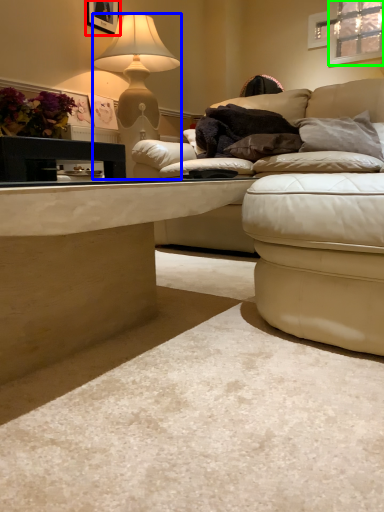
Question: Estimate the real-world distances between objects in this image. Which object is farther from picture frame (highlighted by a red box), lamp (highlighted by a blue box) or window (highlighted by a green box)?

Choices:
 (A) lamp
 (B) window

Answer: (B)